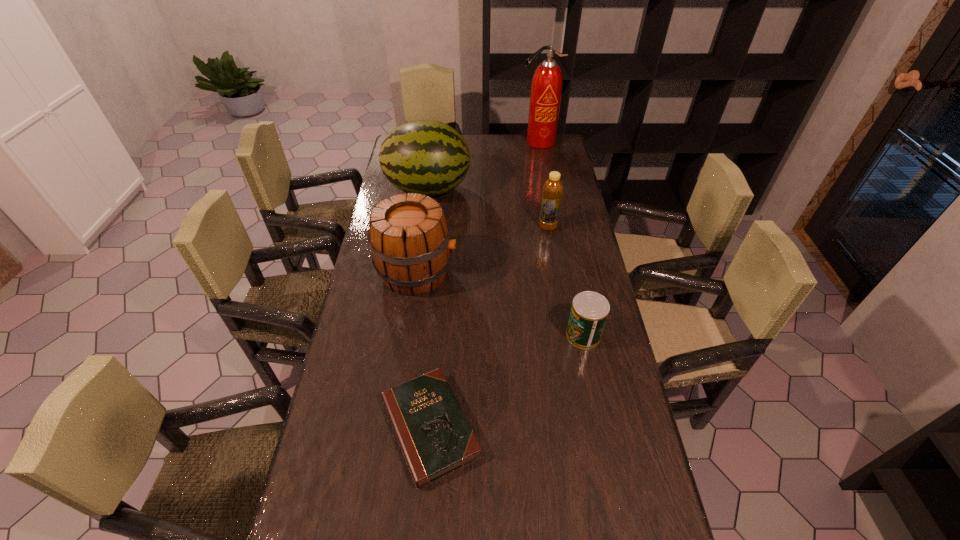
Where is `free space between the second shortest object and the watermelon`? free space between the second shortest object and the watermelon is located at coordinates (506, 262).

I want to click on empty space between the tallest object and the watermelon, so click(483, 166).

The width and height of the screenshot is (960, 540). I want to click on empty location between the nearest object and the bottle, so click(x=489, y=327).

At what (x,y) coordinates should I click in order to perform the action: click on free space between the can and the watermelon. Please return your answer as a coordinate pair (x, y). The image size is (960, 540). Looking at the image, I should click on (506, 262).

What are the coordinates of `vacant region between the cider and the bottle` in the screenshot? It's located at (482, 249).

Identify the location of the third closest object to the fire extinguisher. Image resolution: width=960 pixels, height=540 pixels. (409, 237).

This screenshot has height=540, width=960. I want to click on object identified as the third closest to the farthest object, so click(409, 237).

Identify the location of vacant space that satisfies the following two spatial constraints: 1. on the side of the cider where the spigot is located; 2. on the left side of the Bible. The width and height of the screenshot is (960, 540). (396, 427).

Where is `free space in the image that satisfies the following two spatial constraints: 1. at the stem end of the can; 2. on the right side of the fifth nearest object`? The height and width of the screenshot is (540, 960). free space in the image that satisfies the following two spatial constraints: 1. at the stem end of the can; 2. on the right side of the fifth nearest object is located at coordinates (407, 335).

Find the location of `blank space that satisfies the following two spatial constraints: 1. on the front side of the second nearest object; 2. on the right side of the bottle`. blank space that satisfies the following two spatial constraints: 1. on the front side of the second nearest object; 2. on the right side of the bottle is located at coordinates (565, 335).